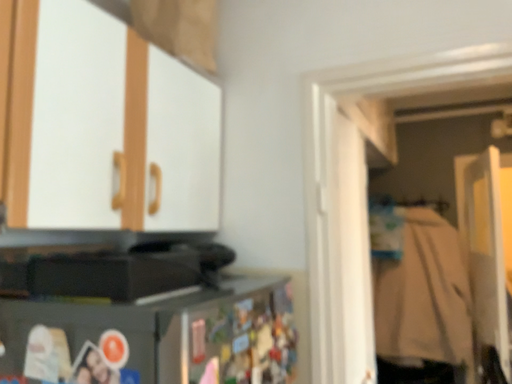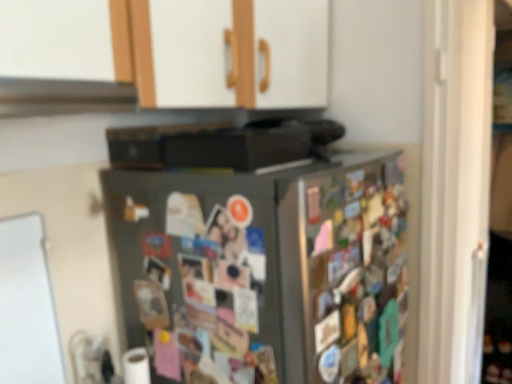
Question: Which way did the camera rotate in the video?

Choices:
 (A) rotated left
 (B) rotated right

Answer: (A)